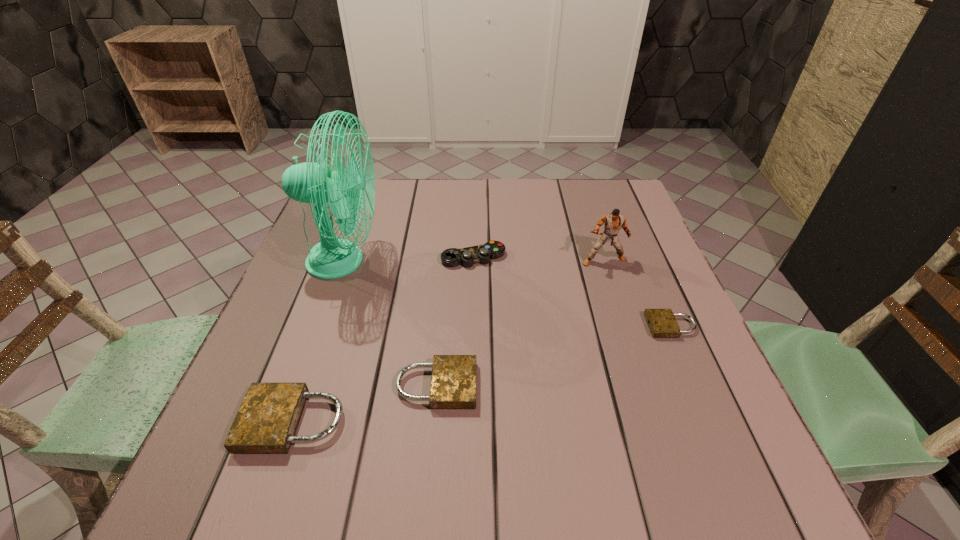
You are a GUI agent. You are given a task and a screenshot of the screen. Output one action in this format:
    pyautogui.click(x=<x>, y=<y>)
    Task: Click on the blank space at the left edge
    The height and width of the screenshot is (540, 960).
    Given the screenshot: What is the action you would take?
    pyautogui.click(x=300, y=259)

This screenshot has height=540, width=960. Find the location of `vacant area at the right edge`. vacant area at the right edge is located at coordinates (618, 309).

This screenshot has width=960, height=540. In the image, there is a desktop. Find the location of `free region at the far right corner`. free region at the far right corner is located at coordinates (588, 211).

You are a GUI agent. You are given a task and a screenshot of the screen. Output one action in this format:
    pyautogui.click(x=<x>, y=<y>)
    Task: Click on the free location at the near right corner of the desktop
    
    Given the screenshot: What is the action you would take?
    pyautogui.click(x=669, y=398)

You are a GUI agent. You are given a task and a screenshot of the screen. Output one action in this format:
    pyautogui.click(x=<x>, y=<y>)
    Task: Click on the vacant space that is in between the fan and the second padlock from left to right
    This screenshot has height=540, width=960.
    Given the screenshot: What is the action you would take?
    pyautogui.click(x=390, y=323)

The width and height of the screenshot is (960, 540). Find the location of `empty space between the second padlock from right to left and the control`. empty space between the second padlock from right to left and the control is located at coordinates (455, 321).

I want to click on vacant area that lies between the control and the second padlock from left to right, so click(x=455, y=321).

You are a GUI agent. You are given a task and a screenshot of the screen. Output one action in this format:
    pyautogui.click(x=<x>, y=<y>)
    Task: Click on the empty space between the second padlock from right to left and the control
    The width and height of the screenshot is (960, 540).
    Given the screenshot: What is the action you would take?
    pyautogui.click(x=455, y=321)

Identify the location of free space between the second padlock from left to right and the control. (455, 321).

This screenshot has height=540, width=960. In order to click on free spot between the shortest object and the fan in this screenshot , I will do `click(508, 294)`.